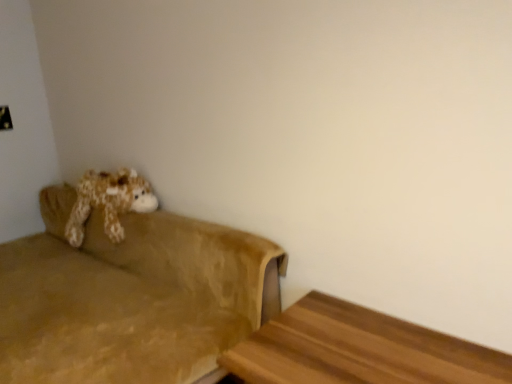
Question: Would you say suede-like brown couch at left is inside or outside wooden table at lower right?

Choices:
 (A) inside
 (B) outside

Answer: (B)

Question: In terms of height, does suede-like brown couch at left look taller or shorter compared to wooden table at lower right?

Choices:
 (A) short
 (B) tall

Answer: (B)

Question: Which object is the closest to the suede-like brown couch at left?

Choices:
 (A) fluffy brown plush at left
 (B) wooden table at lower right

Answer: (A)

Question: Considering the real-world distances, which object is closest to the suede-like brown couch at left?

Choices:
 (A) fluffy brown plush at left
 (B) wooden table at lower right

Answer: (A)